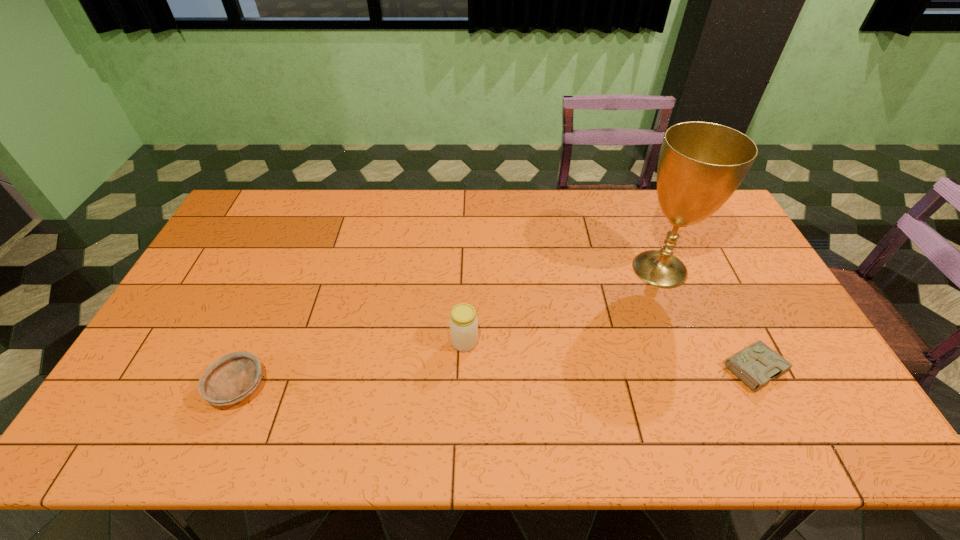
Image resolution: width=960 pixels, height=540 pixels. I want to click on free spot that satisfies the following two spatial constraints: 1. on the back side of the bowl; 2. on the right side of the tallest object, so click(x=290, y=269).

In order to click on free spot that satisfies the following two spatial constraints: 1. on the front side of the shortest object; 2. on the right side of the tallest object in this screenshot , I will do `click(700, 369)`.

Identify the location of free location that satisfies the following two spatial constraints: 1. on the back side of the second object from left to right; 2. on the right side of the bowl. (258, 342).